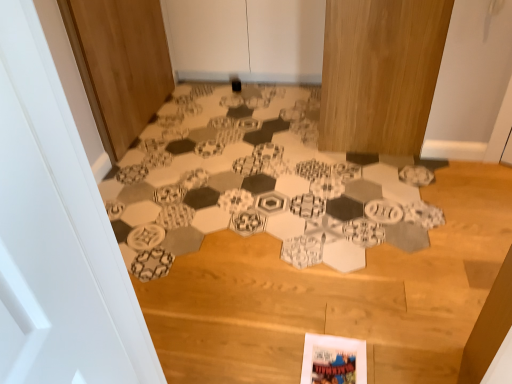
Question: Can you confirm if wooden door at left, marked as the 2th door in a right-to-left arrangement, is smaller than white matte door at center, the 1th door from the right?

Choices:
 (A) no
 (B) yes

Answer: (A)

Question: Is wooden door at left, marked as the 2th door in a right-to-left arrangement, completely or partially outside of white matte door at center, which is counted as the second door, starting from the left?

Choices:
 (A) no
 (B) yes

Answer: (B)

Question: Is wooden door at left, the first door viewed from the left, facing towards white matte door at center, which is counted as the second door, starting from the left?

Choices:
 (A) yes
 (B) no

Answer: (A)

Question: Is wooden door at left, the first door viewed from the left, thinner than white matte door at center, the 1th door from the right?

Choices:
 (A) no
 (B) yes

Answer: (B)

Question: From the image's perspective, is wooden door at left, the first door viewed from the left, beneath white matte door at center, the 1th door from the right?

Choices:
 (A) no
 (B) yes

Answer: (B)

Question: From the image's perspective, is white matte door at center, which is counted as the second door, starting from the left, located above or below wooden door at left, the first door viewed from the left?

Choices:
 (A) above
 (B) below

Answer: (A)

Question: In terms of height, does white matte door at center, which is counted as the second door, starting from the left, look taller or shorter compared to wooden door at left, the first door viewed from the left?

Choices:
 (A) short
 (B) tall

Answer: (A)

Question: Choose the correct answer: Is white matte door at center, which is counted as the second door, starting from the left, inside wooden door at left, the first door viewed from the left, or outside it?

Choices:
 (A) inside
 (B) outside

Answer: (B)

Question: Looking at the image, does white matte door at center, the 1th door from the right, seem bigger or smaller compared to wooden door at left, the first door viewed from the left?

Choices:
 (A) big
 (B) small

Answer: (B)

Question: Considering the positions of wooden door at left, marked as the 2th door in a right-to-left arrangement, and white matte door at center, the 1th door from the right, in the image, is wooden door at left, marked as the 2th door in a right-to-left arrangement, bigger or smaller than white matte door at center, the 1th door from the right,?

Choices:
 (A) big
 (B) small

Answer: (A)

Question: From a real-world perspective, relative to white matte door at center, which is counted as the second door, starting from the left, is wooden door at left, the first door viewed from the left, vertically above or below?

Choices:
 (A) below
 (B) above

Answer: (B)

Question: Considering the positions of wooden door at left, marked as the 2th door in a right-to-left arrangement, and white matte door at center, which is counted as the second door, starting from the left, in the image, is wooden door at left, marked as the 2th door in a right-to-left arrangement, wider or thinner than white matte door at center, which is counted as the second door, starting from the left,?

Choices:
 (A) thin
 (B) wide

Answer: (A)

Question: From their relative heights in the image, would you say wooden door at left, marked as the 2th door in a right-to-left arrangement, is taller or shorter than white matte door at center, the 1th door from the right?

Choices:
 (A) short
 (B) tall

Answer: (B)

Question: Is white paper at center situated inside white matte door at center, which is counted as the second door, starting from the left, or outside?

Choices:
 (A) inside
 (B) outside

Answer: (B)

Question: Is white paper at center in front of or behind white matte door at center, the 1th door from the right, in the image?

Choices:
 (A) behind
 (B) front

Answer: (B)